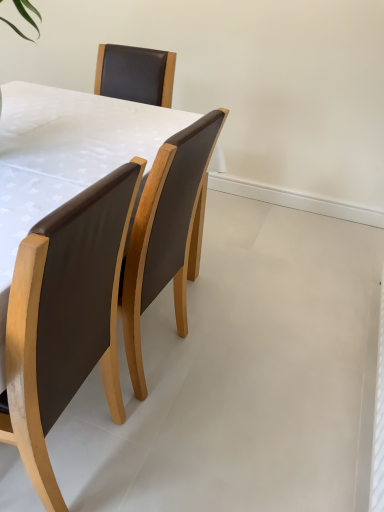
This screenshot has width=384, height=512. I want to click on spots to the right of brown leather chair at left, so click(x=183, y=449).